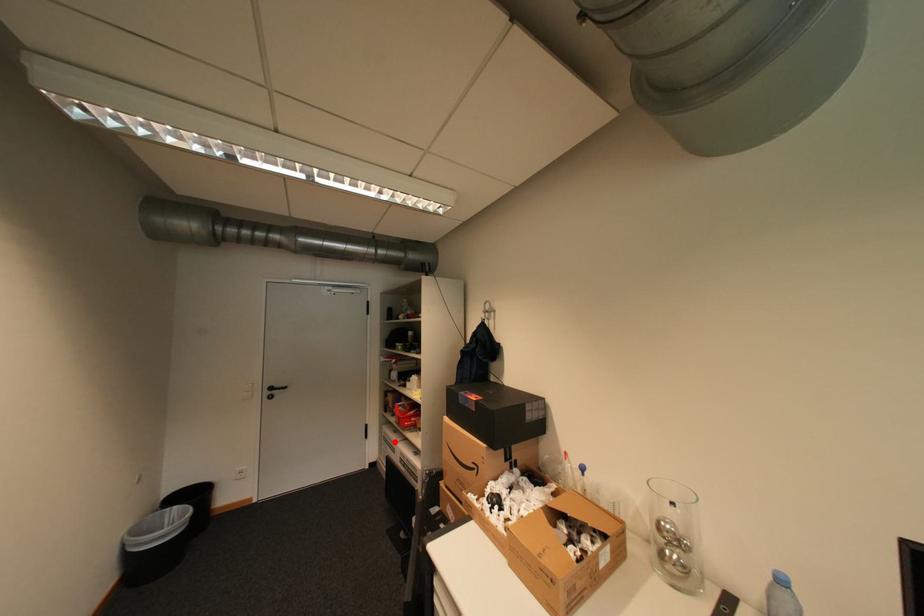
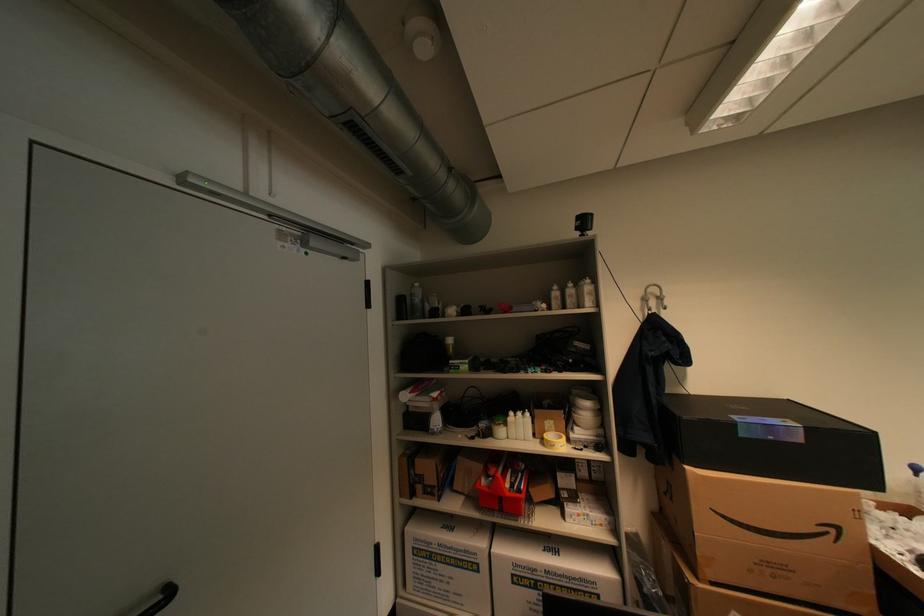
Where in the second image is the point corresponding to the highlighted location from the first image?

(439, 556)